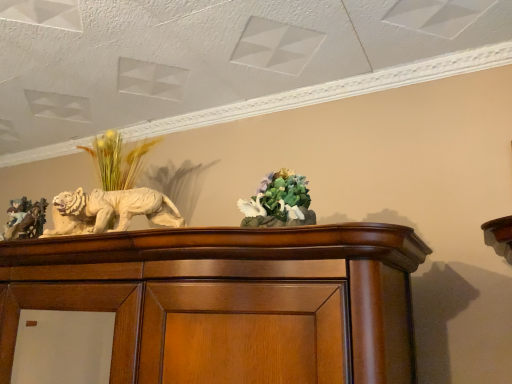
Question: Should I look upward or downward to see green matte floral arrangement at center?

Choices:
 (A) down
 (B) up

Answer: (A)

Question: Does green matte floral arrangement at center have a lesser height compared to white glossy sculpture at left?

Choices:
 (A) no
 (B) yes

Answer: (A)

Question: Is green matte floral arrangement at center positioned with its back to white glossy sculpture at left?

Choices:
 (A) no
 (B) yes

Answer: (A)

Question: Can you confirm if green matte floral arrangement at center is taller than white glossy sculpture at left?

Choices:
 (A) yes
 (B) no

Answer: (A)

Question: Considering the relative sizes of green matte floral arrangement at center and white glossy sculpture at left in the image provided, is green matte floral arrangement at center bigger than white glossy sculpture at left?

Choices:
 (A) yes
 (B) no

Answer: (B)

Question: Considering the relative sizes of green matte floral arrangement at center and white glossy sculpture at left in the image provided, is green matte floral arrangement at center smaller than white glossy sculpture at left?

Choices:
 (A) no
 (B) yes

Answer: (B)

Question: From a real-world perspective, is green matte floral arrangement at center on top of white glossy sculpture at left?

Choices:
 (A) no
 (B) yes

Answer: (B)

Question: Does green matte floral arrangement at center have a larger size compared to matte brown figurine at left?

Choices:
 (A) yes
 (B) no

Answer: (B)

Question: Considering the relative sizes of green matte floral arrangement at center and matte brown figurine at left in the image provided, is green matte floral arrangement at center wider than matte brown figurine at left?

Choices:
 (A) yes
 (B) no

Answer: (B)

Question: Considering the relative positions of green matte floral arrangement at center and matte brown figurine at left in the image provided, is green matte floral arrangement at center behind matte brown figurine at left?

Choices:
 (A) yes
 (B) no

Answer: (B)

Question: Is green matte floral arrangement at center facing away from matte brown figurine at left?

Choices:
 (A) no
 (B) yes

Answer: (A)

Question: Is green matte floral arrangement at center at the right side of matte brown figurine at left?

Choices:
 (A) yes
 (B) no

Answer: (A)

Question: Can you confirm if green matte floral arrangement at center is positioned to the left of matte brown figurine at left?

Choices:
 (A) yes
 (B) no

Answer: (B)

Question: Is white glossy sculpture at left located outside green matte floral arrangement at center?

Choices:
 (A) yes
 (B) no

Answer: (A)